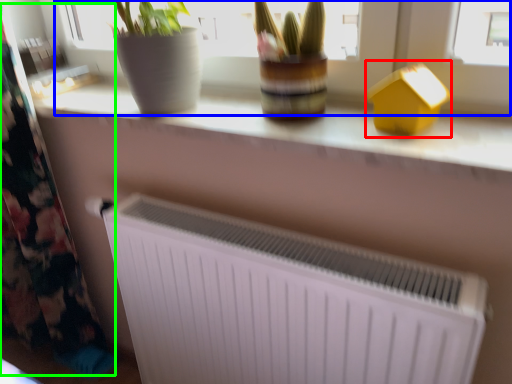
Question: Considering the real-world distances, which object is farthest from toy (highlighted by a red box)? bay window (highlighted by a blue box) or curtain (highlighted by a green box)?

Choices:
 (A) bay window
 (B) curtain

Answer: (B)